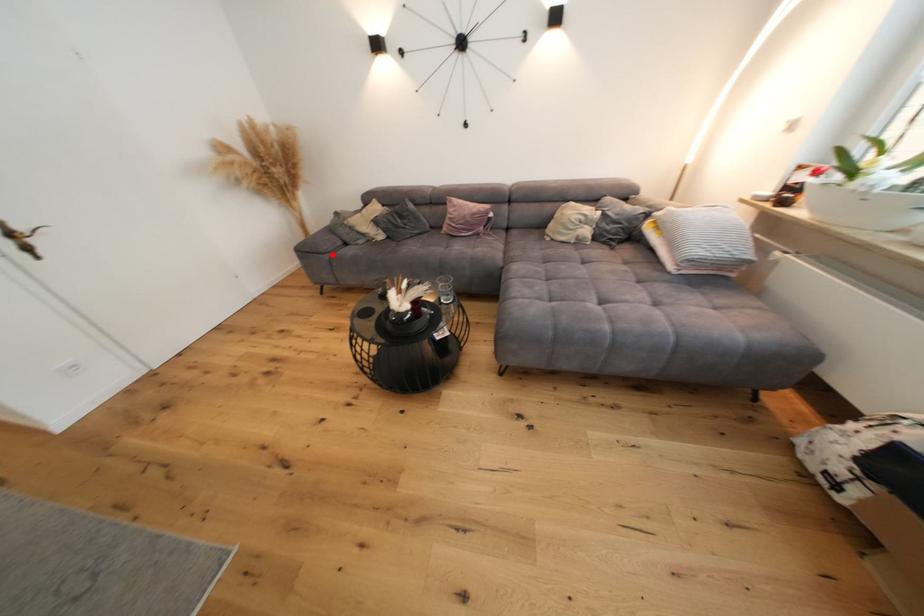
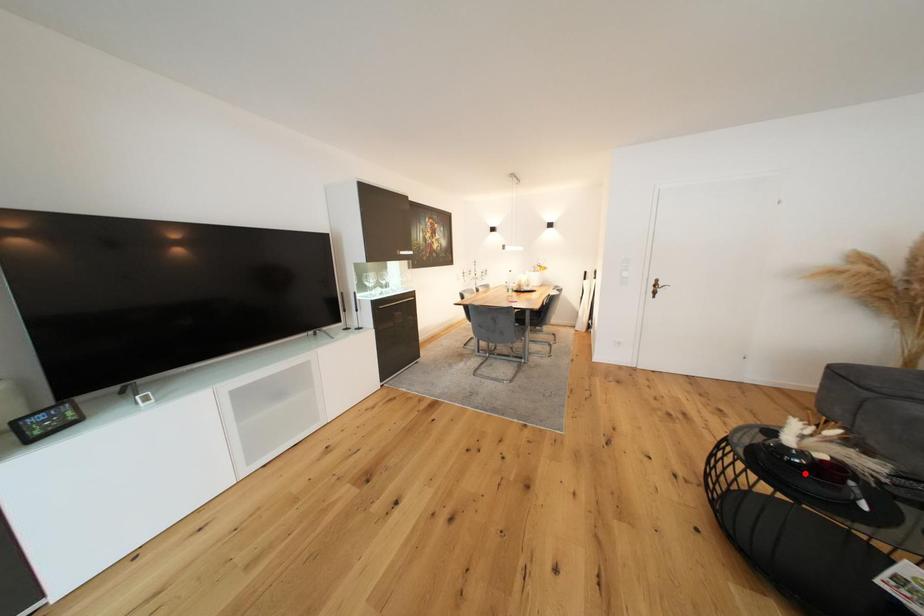
I am providing you with two images of the same scene from different viewpoints. A red point is marked on the first image and another point is marked on the second image. Is the marked point in image1 the same physical position as the marked point in image2?

No